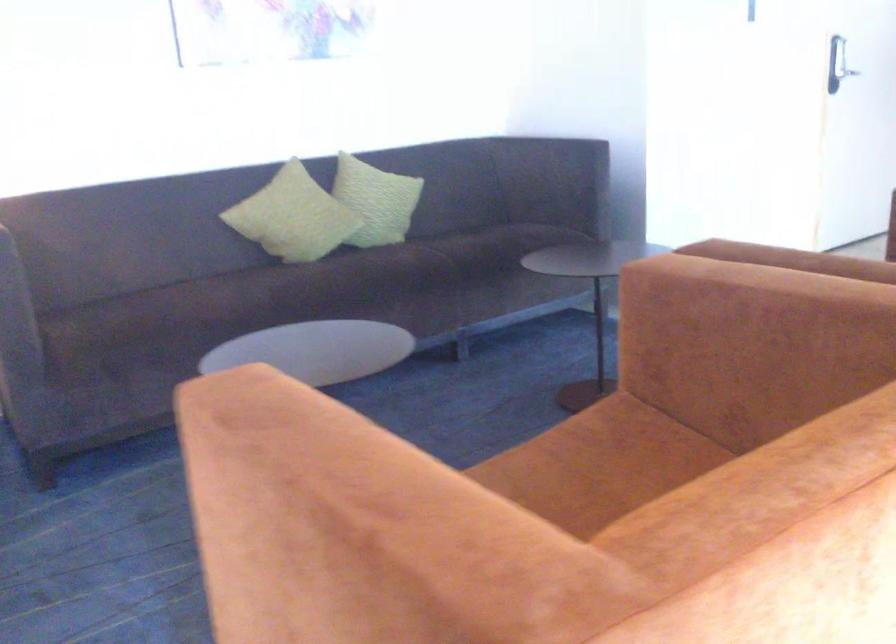
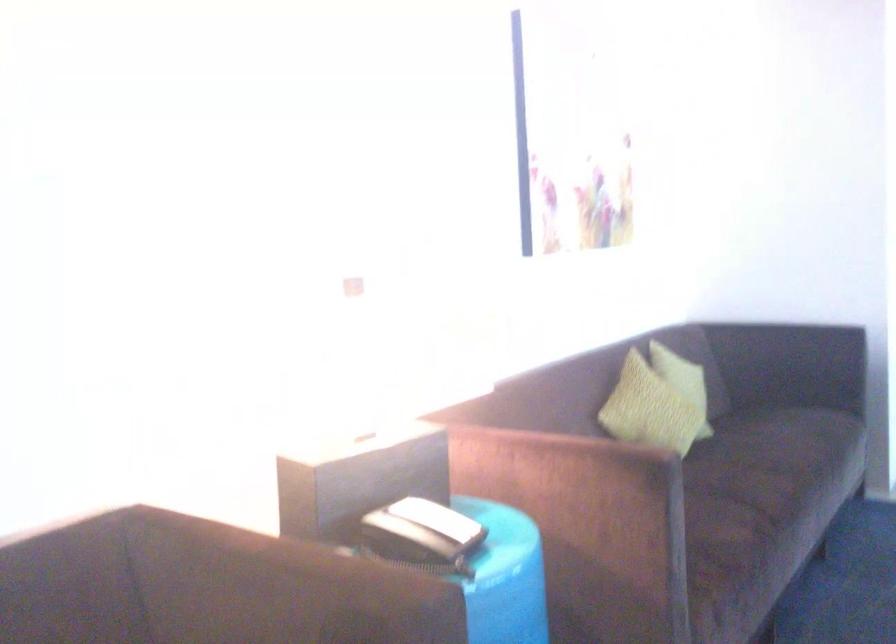
Question: The images are taken continuously from a first-person perspective. In which direction are you moving?

Choices:
 (A) Left
 (B) Right
 (C) Forward
 (D) Backward

Answer: (A)